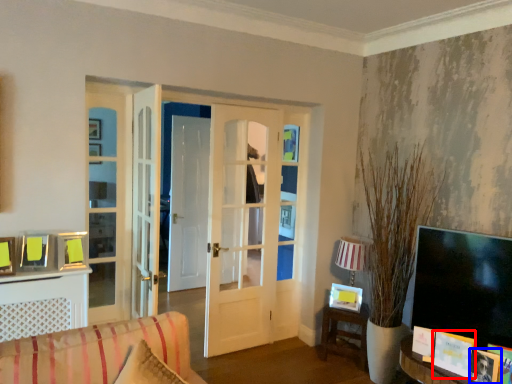
Question: Which of the following is the closest to the observer, book (highlighted by a red box) or picture frame (highlighted by a blue box)?

Choices:
 (A) book
 (B) picture frame

Answer: (B)